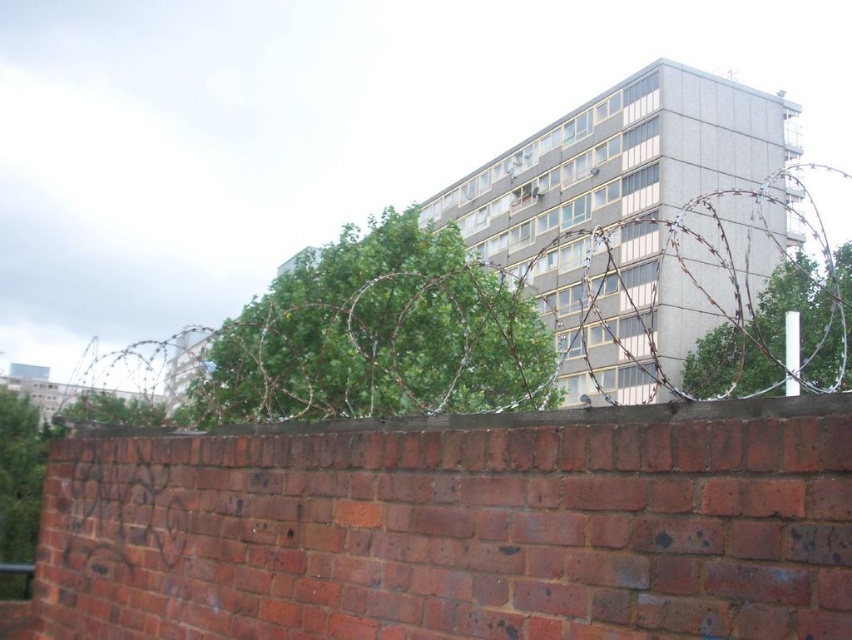
Question: Which point appears farthest from the camera in this image?

Choices:
 (A) (x=349, y=321)
 (B) (x=596, y=584)

Answer: (A)

Question: Among these objects, which one is nearest to the camera?

Choices:
 (A) red brick wall at lower center
 (B) barbed wire at upper center

Answer: (A)

Question: Does red brick wall at lower center have a lesser width compared to barbed wire at upper center?

Choices:
 (A) yes
 (B) no

Answer: (A)

Question: Does red brick wall at lower center have a greater width compared to barbed wire at upper center?

Choices:
 (A) no
 (B) yes

Answer: (A)

Question: Is red brick wall at lower center bigger than barbed wire at upper center?

Choices:
 (A) no
 (B) yes

Answer: (A)